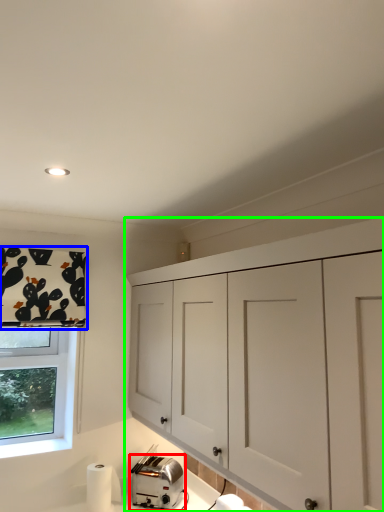
Question: Based on their relative distances, which object is farther from toaster (highlighted by a red box)? Choose from curtain (highlighted by a blue box) and cabinetry (highlighted by a green box).

Choices:
 (A) curtain
 (B) cabinetry

Answer: (A)